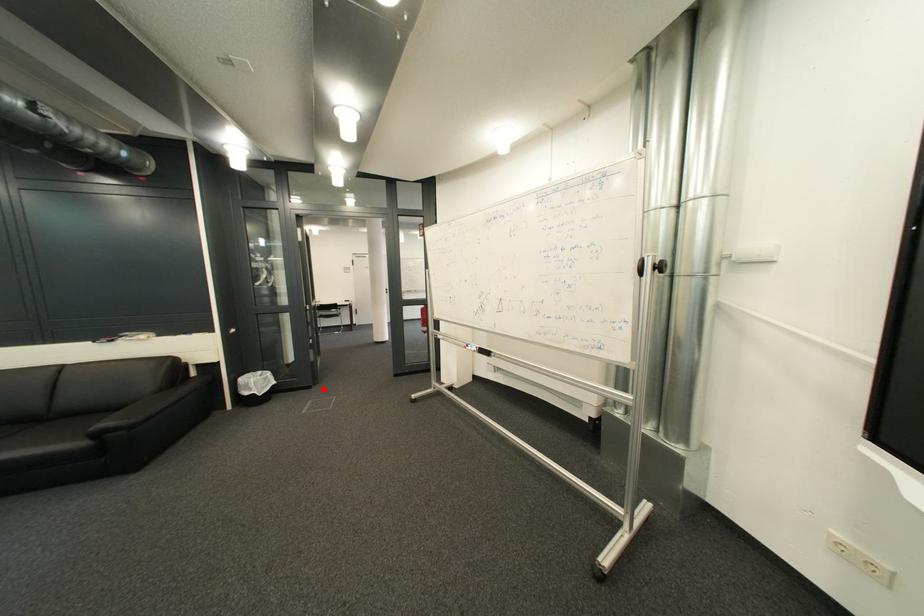
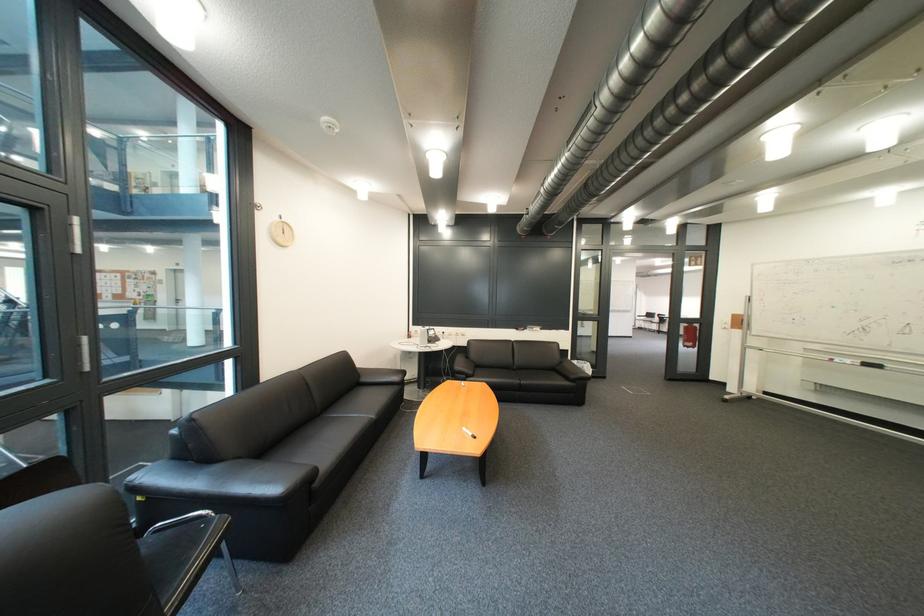
Question: I am providing you with two images of the same scene from different viewpoints. Image1 has a red point marked. In image2, the corresponding 3D location appears at what relative position? Reply with the corresponding letter.

Choices:
 (A) Closer
 (B) Farther

Answer: (B)